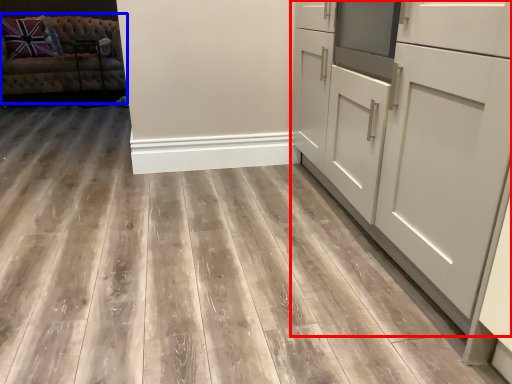
Question: Which of the following is the farthest to the observer, cabinetry (highlighted by a red box) or studio couch (highlighted by a blue box)?

Choices:
 (A) cabinetry
 (B) studio couch

Answer: (B)